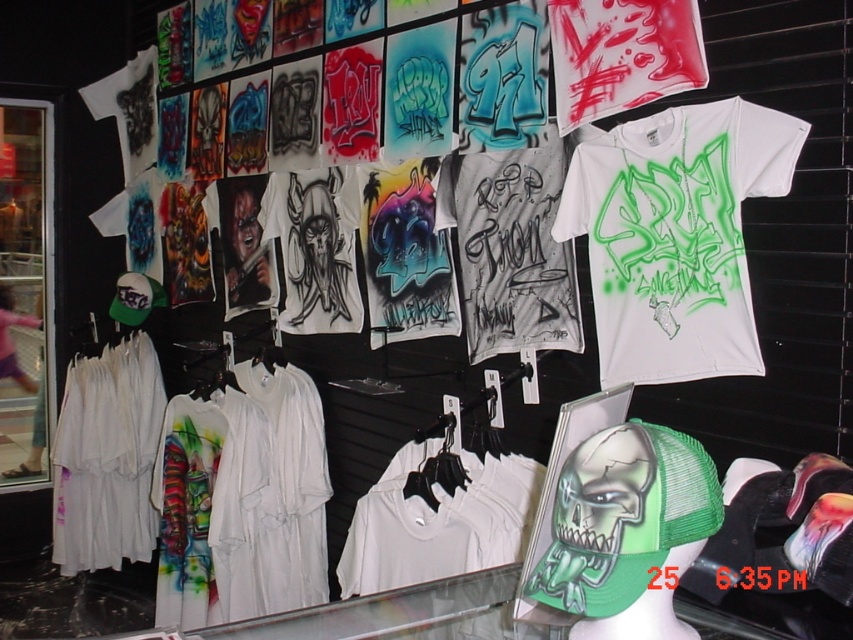
Looking at this image, you are standing in front of the storefront window and want to touch the point at coordinates point (677, 269). If your arm can reach up to 5 feet, can you reach it?

The distance of point (677, 269) from viewer is 5.54 feet, so no, your arm cannot reach it since it is beyond the 5 feet limit.